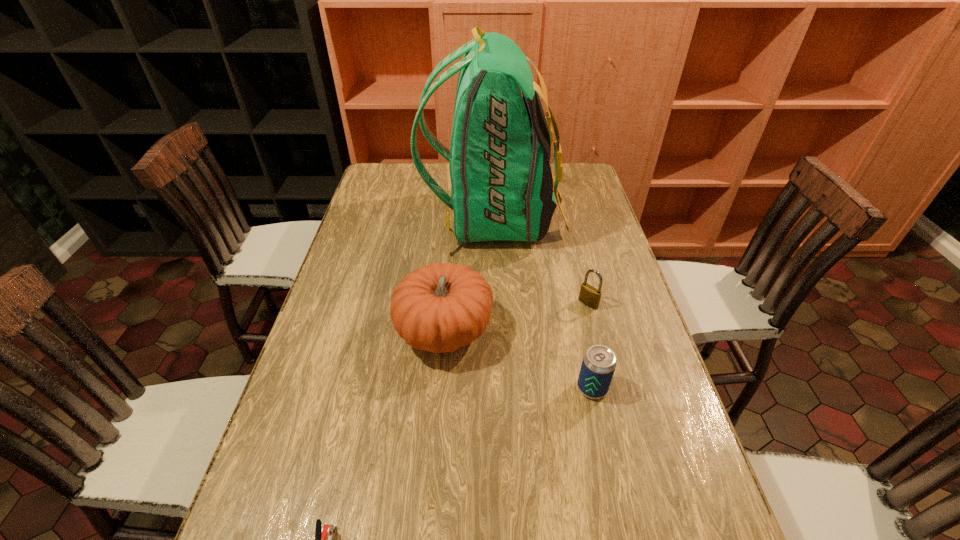
Locate an element on the screen. The height and width of the screenshot is (540, 960). unoccupied area between the padlock and the farthest object is located at coordinates (541, 261).

Identify the location of unoccupied position between the backpack and the fourth farthest object. (543, 303).

Locate an element on the screen. Image resolution: width=960 pixels, height=540 pixels. vacant area that lies between the padlock and the pumpkin is located at coordinates (516, 318).

Find the location of `vacant area that lies between the fourth farthest object and the padlock`. vacant area that lies between the fourth farthest object and the padlock is located at coordinates (590, 346).

Identify the location of object that ranks as the third closest to the padlock. The image size is (960, 540). (439, 308).

You are a GUI agent. You are given a task and a screenshot of the screen. Output one action in this format:
    pyautogui.click(x=<x>, y=<y>)
    Task: Click on the closest object relative to the leftmost object
    The height and width of the screenshot is (540, 960).
    Given the screenshot: What is the action you would take?
    pyautogui.click(x=439, y=308)

You are a GUI agent. You are given a task and a screenshot of the screen. Output one action in this format:
    pyautogui.click(x=<x>, y=<y>)
    Task: Click on the free space that satisfies the following two spatial constraints: 1. on the front side of the second nearest object; 2. on the left side of the pumpkin
    
    Given the screenshot: What is the action you would take?
    pyautogui.click(x=440, y=388)

The height and width of the screenshot is (540, 960). I want to click on free space that satisfies the following two spatial constraints: 1. on the back of the farthest object; 2. on the right side of the padlock, so click(x=497, y=303).

At what (x,y) coordinates should I click in order to perform the action: click on vacant region that satisfies the following two spatial constraints: 1. on the back of the beer can; 2. on the right side of the backpack. Please return your answer as a coordinate pair (x, y). Looking at the image, I should click on (501, 388).

In order to click on vacant point that satisfies the following two spatial constraints: 1. on the back of the padlock; 2. on the left side of the tallest object in this screenshot , I will do `click(497, 303)`.